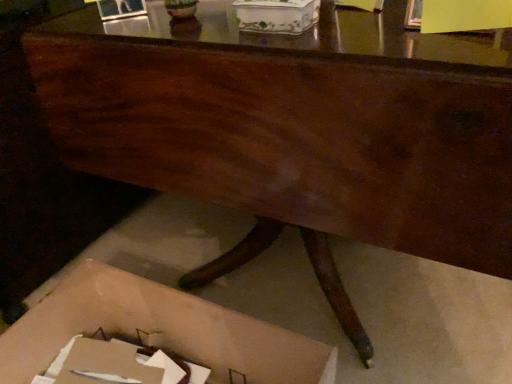
Question: Is cardboard box at lower center, which ranks as the first storage box in bottom-to-top order, smaller than porcelain floral box at center, positioned as the second storage box in bottom-to-top order?

Choices:
 (A) no
 (B) yes

Answer: (A)

Question: From a real-world perspective, is cardboard box at lower center, the 2th storage box from the top, physically below porcelain floral box at center, positioned as the second storage box in bottom-to-top order?

Choices:
 (A) yes
 (B) no

Answer: (A)

Question: Can you confirm if cardboard box at lower center, which ranks as the first storage box in bottom-to-top order, is taller than porcelain floral box at center, marked as the first storage box in a top-to-bottom arrangement?

Choices:
 (A) no
 (B) yes

Answer: (B)

Question: Would you consider cardboard box at lower center, which ranks as the first storage box in bottom-to-top order, to be distant from porcelain floral box at center, positioned as the second storage box in bottom-to-top order?

Choices:
 (A) yes
 (B) no

Answer: (B)

Question: Is cardboard box at lower center, the 2th storage box from the top, surrounding porcelain floral box at center, positioned as the second storage box in bottom-to-top order?

Choices:
 (A) no
 (B) yes

Answer: (A)

Question: Considering the relative sizes of cardboard box at lower center, the 2th storage box from the top, and porcelain floral box at center, marked as the first storage box in a top-to-bottom arrangement, in the image provided, is cardboard box at lower center, the 2th storage box from the top, bigger than porcelain floral box at center, marked as the first storage box in a top-to-bottom arrangement,?

Choices:
 (A) yes
 (B) no

Answer: (A)

Question: Considering the relative sizes of porcelain floral box at center, positioned as the second storage box in bottom-to-top order, and cardboard box at lower center, the 2th storage box from the top, in the image provided, is porcelain floral box at center, positioned as the second storage box in bottom-to-top order, bigger than cardboard box at lower center, the 2th storage box from the top,?

Choices:
 (A) no
 (B) yes

Answer: (A)

Question: Is porcelain floral box at center, positioned as the second storage box in bottom-to-top order, not near cardboard box at lower center, the 2th storage box from the top?

Choices:
 (A) yes
 (B) no

Answer: (B)

Question: From the image's perspective, is porcelain floral box at center, marked as the first storage box in a top-to-bottom arrangement, beneath cardboard box at lower center, the 2th storage box from the top?

Choices:
 (A) yes
 (B) no

Answer: (B)

Question: From the image's perspective, is porcelain floral box at center, positioned as the second storage box in bottom-to-top order, above cardboard box at lower center, the 2th storage box from the top?

Choices:
 (A) yes
 (B) no

Answer: (A)

Question: Is porcelain floral box at center, positioned as the second storage box in bottom-to-top order, to the right of cardboard box at lower center, which ranks as the first storage box in bottom-to-top order, from the viewer's perspective?

Choices:
 (A) no
 (B) yes

Answer: (B)

Question: Considering the relative sizes of porcelain floral box at center, marked as the first storage box in a top-to-bottom arrangement, and cardboard box at lower center, the 2th storage box from the top, in the image provided, is porcelain floral box at center, marked as the first storage box in a top-to-bottom arrangement, thinner than cardboard box at lower center, the 2th storage box from the top,?

Choices:
 (A) no
 (B) yes

Answer: (B)

Question: Is point (8, 382) closer or farther from the camera than point (294, 14)?

Choices:
 (A) farther
 (B) closer

Answer: (A)